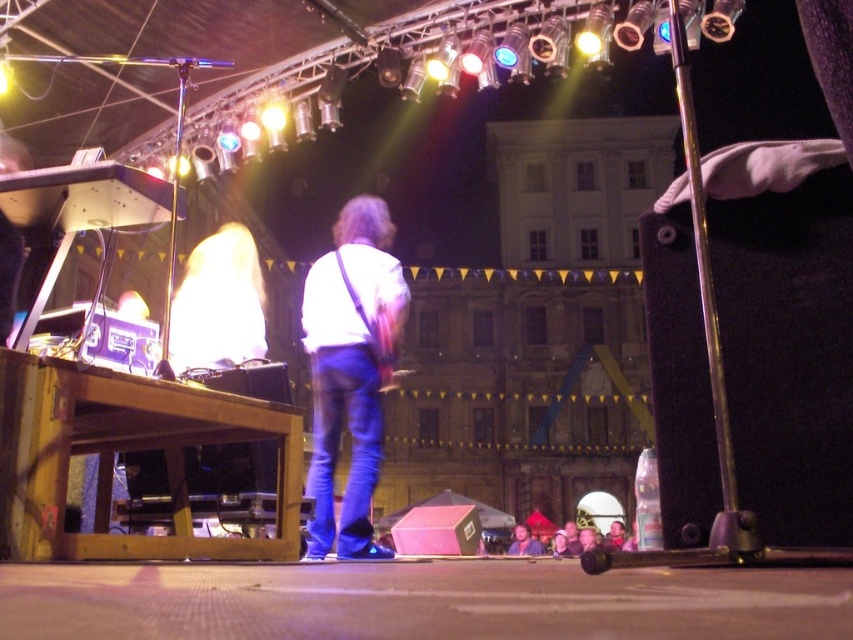
In the scene shown: You are a photographer at the concert and want to capture both the smooth skin face at lower center and the smooth skin face at center in a single shot. Which face should you focus on to ensure the bigger one is in sharp focus?

You should focus on the smooth skin face at lower center because it is bigger than the smooth skin face at center, so ensuring it is in sharp focus will capture both effectively.